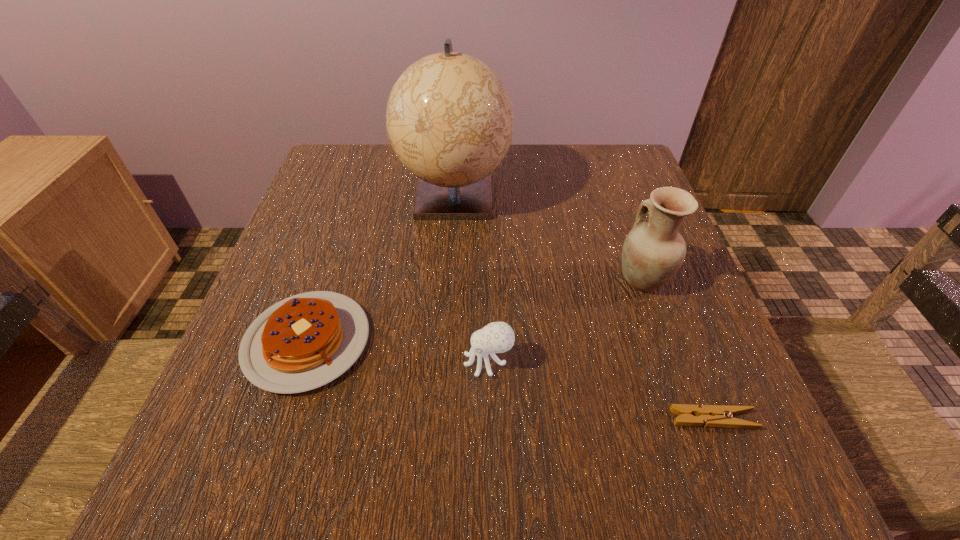
This screenshot has width=960, height=540. Find the location of `the tallest object`. the tallest object is located at coordinates (450, 120).

Locate an element on the screen. the farthest object is located at coordinates (450, 120).

Locate an element on the screen. The image size is (960, 540). the fourth shortest object is located at coordinates (652, 253).

You are a GUI agent. You are given a task and a screenshot of the screen. Output one action in this format:
    pyautogui.click(x=<x>, y=<y>)
    Task: Click on the octopus
    The width and height of the screenshot is (960, 540).
    Given the screenshot: What is the action you would take?
    pyautogui.click(x=497, y=337)

Find the location of a particular element. The height and width of the screenshot is (540, 960). pancake is located at coordinates (305, 341).

I want to click on the shortest object, so click(720, 416).

Find the location of a particular element. The height and width of the screenshot is (540, 960). clothespin is located at coordinates click(x=720, y=416).

Where is `vacant area located on the surface of the farthest object showing Europe and Africa`? The image size is (960, 540). vacant area located on the surface of the farthest object showing Europe and Africa is located at coordinates (449, 266).

Locate an element on the screen. free space located on the front of the fourth shortest object is located at coordinates (668, 353).

What are the coordinates of `vacant space located on the front-facing side of the third tallest object` in the screenshot? It's located at (309, 361).